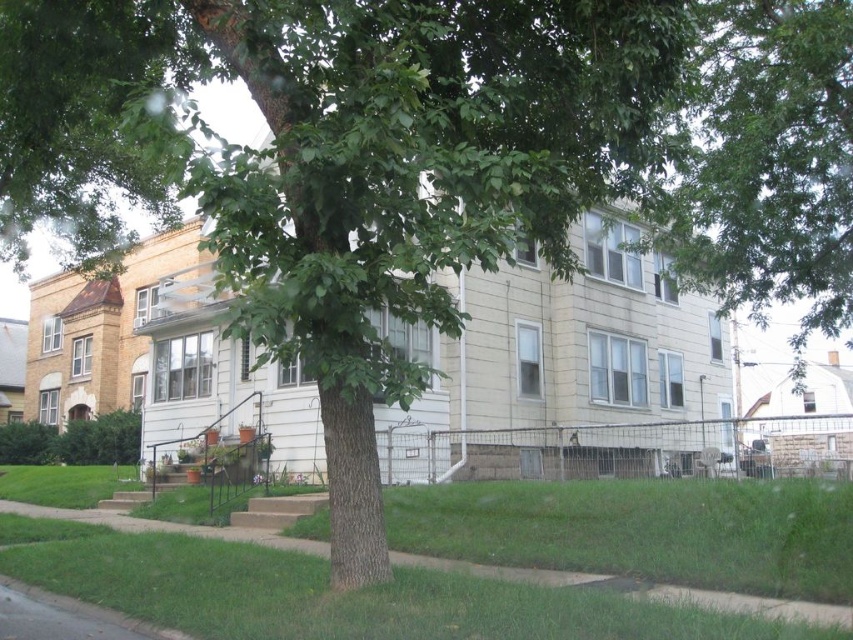
Question: Does green leafy tree at upper center have a larger size compared to green grass at lower center?

Choices:
 (A) yes
 (B) no

Answer: (A)

Question: Which object is farther from the camera taking this photo?

Choices:
 (A) green grass at lower center
 (B) green leafy tree at upper center

Answer: (B)

Question: Observing the image, what is the correct spatial positioning of green leafy tree at upper center in reference to green grass at lower center?

Choices:
 (A) left
 (B) right

Answer: (B)

Question: Is green leafy tree at upper center to the left of green grass at lower center from the viewer's perspective?

Choices:
 (A) yes
 (B) no

Answer: (B)

Question: Which point is closer to the camera?

Choices:
 (A) (239, 570)
 (B) (762, 44)

Answer: (A)